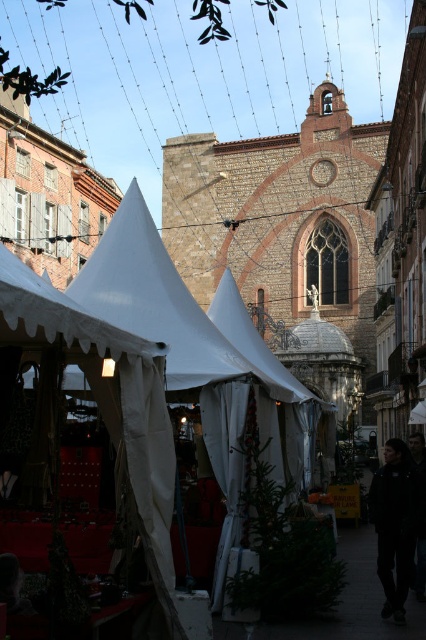
Question: Where is white canvas tent at left located in relation to white fabric tent at left in the image?

Choices:
 (A) below
 (B) above

Answer: (A)

Question: Can you confirm if white fabric tent at left is thinner than black fabric at lower right?

Choices:
 (A) yes
 (B) no

Answer: (B)

Question: Which point is closer to the camera?

Choices:
 (A) pyautogui.click(x=400, y=500)
 (B) pyautogui.click(x=94, y=259)

Answer: (A)

Question: Is white fabric tent at left thinner than black fabric at lower right?

Choices:
 (A) yes
 (B) no

Answer: (B)

Question: Among these objects, which one is nearest to the camera?

Choices:
 (A) black fabric at lower right
 (B) white fabric tent at left
 (C) white canvas tent at left

Answer: (C)

Question: Among these points, which one is nearest to the camera?

Choices:
 (A) pyautogui.click(x=144, y=476)
 (B) pyautogui.click(x=192, y=314)

Answer: (A)